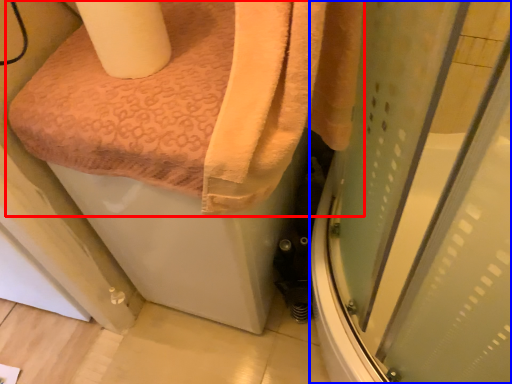
Question: Which of the following is the farthest to the observer, towel (highlighted by a red box) or screen door (highlighted by a blue box)?

Choices:
 (A) towel
 (B) screen door

Answer: (A)